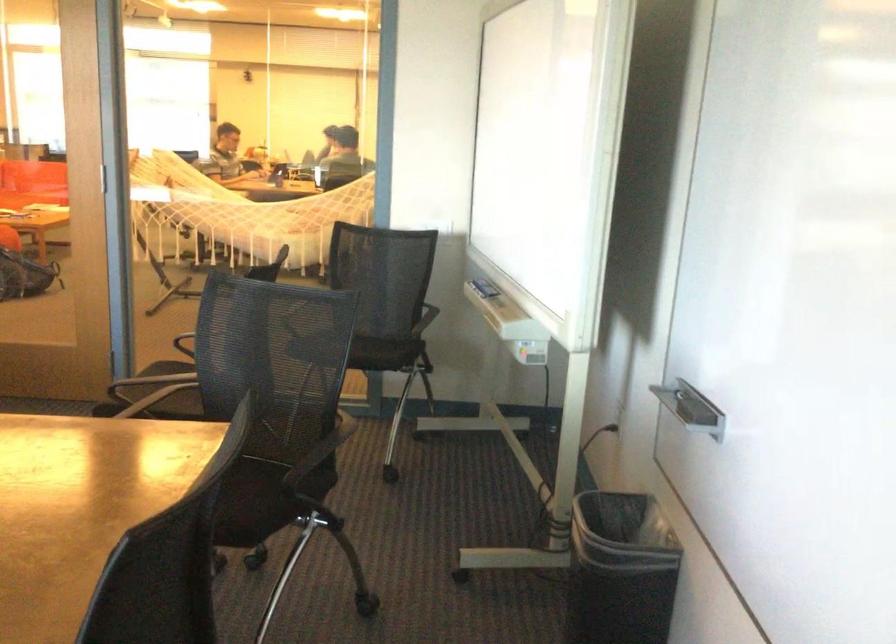
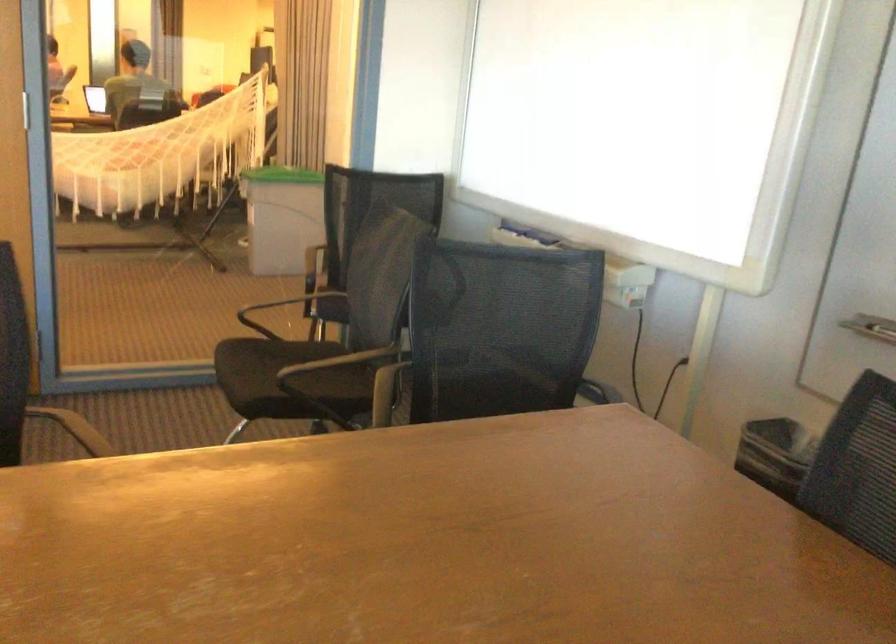
In the second image, find the point that corresponds to [309,222] in the first image.

(161, 156)